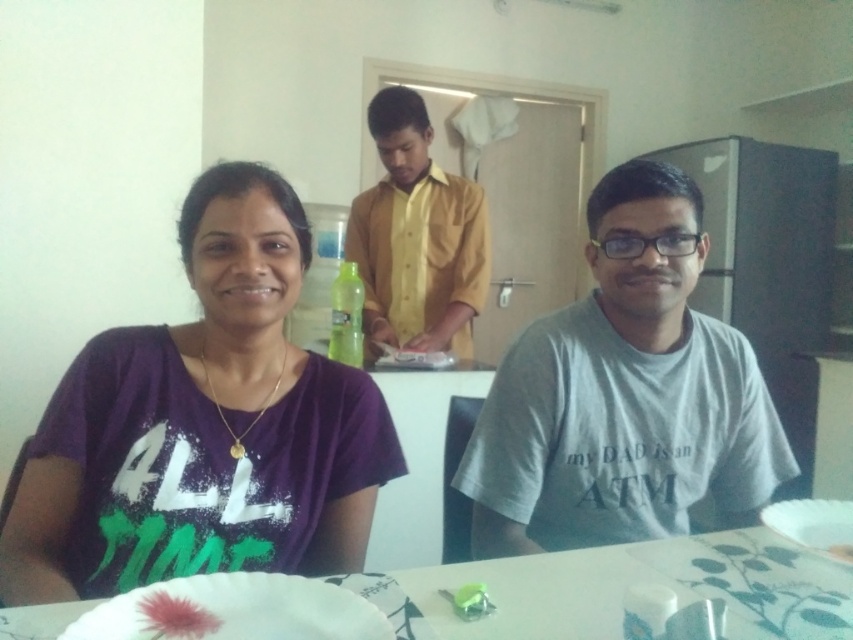
Does purple cotton t-shirt at left have a greater height compared to white paper plate at lower center?

Yes, purple cotton t-shirt at left is taller than white paper plate at lower center.

What do you see at coordinates (202, 426) in the screenshot? The width and height of the screenshot is (853, 640). I see `purple cotton t-shirt at left` at bounding box center [202, 426].

Does point (349, 477) come behind point (291, 628)?

Yes, point (349, 477) is behind point (291, 628).

Find the location of a particular element. The width and height of the screenshot is (853, 640). purple cotton t-shirt at left is located at coordinates (202, 426).

Which is below, purple cotton t-shirt at left or pink feather at lower left?

pink feather at lower left

At what (x,y) coordinates should I click in order to perform the action: click on purple cotton t-shirt at left. Please return your answer as a coordinate pair (x, y). The height and width of the screenshot is (640, 853). Looking at the image, I should click on (202, 426).

In order to click on purple cotton t-shirt at left in this screenshot , I will do `click(202, 426)`.

Which is below, gray cotton t-shirt at center or yellow matte shirt at center?

gray cotton t-shirt at center is below.

Between point (734, 483) and point (349, 232), which one is positioned in front?

Point (734, 483) is in front.

Does point (473, 486) lie in front of point (413, 182)?

Yes, point (473, 486) is in front of point (413, 182).

Locate an element on the screen. The width and height of the screenshot is (853, 640). gray cotton t-shirt at center is located at coordinates (624, 394).